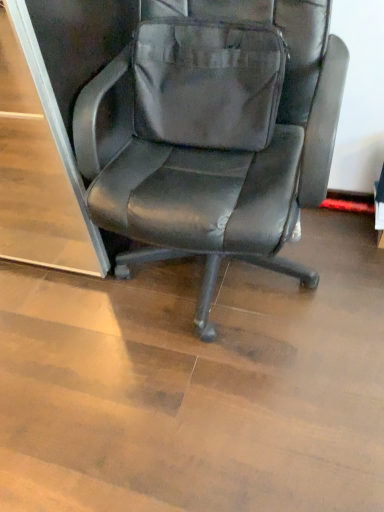
Question: Considering the relative positions of matte gray messenger bag at center and black leather chair at center in the image provided, is matte gray messenger bag at center to the left or to the right of black leather chair at center?

Choices:
 (A) left
 (B) right

Answer: (A)

Question: Considering the positions of matte gray messenger bag at center and black leather chair at center in the image, is matte gray messenger bag at center bigger or smaller than black leather chair at center?

Choices:
 (A) small
 (B) big

Answer: (A)

Question: Considering the positions of matte gray messenger bag at center and black leather chair at center in the image, is matte gray messenger bag at center taller or shorter than black leather chair at center?

Choices:
 (A) tall
 (B) short

Answer: (B)

Question: From the image's perspective, is black leather chair at center above or below matte gray messenger bag at center?

Choices:
 (A) below
 (B) above

Answer: (A)

Question: Looking at their shapes, would you say black leather chair at center is wider or thinner than matte gray messenger bag at center?

Choices:
 (A) wide
 (B) thin

Answer: (A)

Question: Would you say black leather chair at center is inside or outside matte gray messenger bag at center?

Choices:
 (A) outside
 (B) inside

Answer: (A)

Question: In the image, is black leather chair at center positioned in front of or behind matte gray messenger bag at center?

Choices:
 (A) front
 (B) behind

Answer: (A)